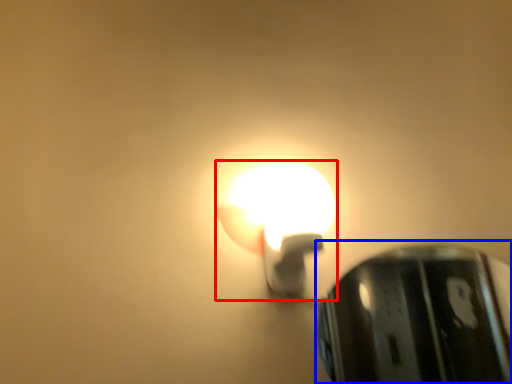
Question: Which object is further to the camera taking this photo, lamp (highlighted by a red box) or lamp (highlighted by a blue box)?

Choices:
 (A) lamp
 (B) lamp

Answer: (B)